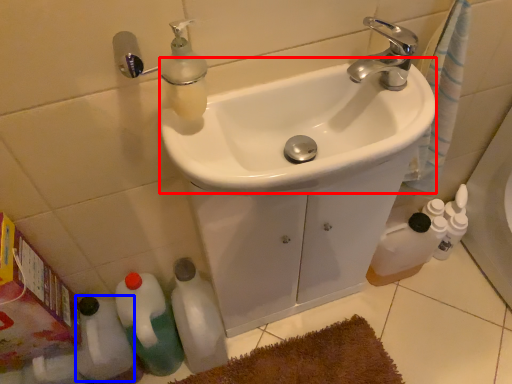
Question: Which of the following is the farthest to the observer, sink (highlighted by a red box) or bottle (highlighted by a blue box)?

Choices:
 (A) sink
 (B) bottle

Answer: (B)